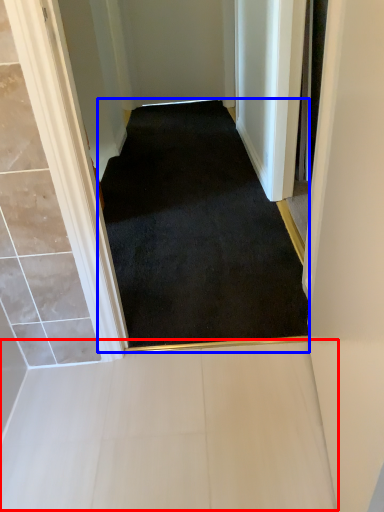
Question: Which of the following is the closest to the observer, path (highlighted by a red box) or doormat (highlighted by a blue box)?

Choices:
 (A) path
 (B) doormat

Answer: (A)